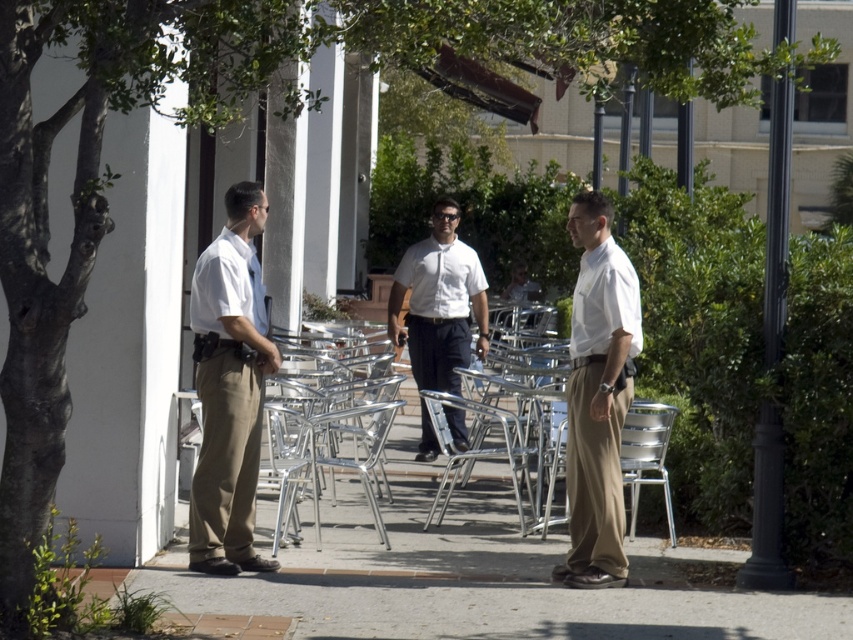
Question: Which object is the closest to the matte khaki pants at center?

Choices:
 (A) smooth concrete pavement at center
 (B) matte khaki pants at left
 (C) silver metallic chair at center
 (D) white shirt at center

Answer: (A)

Question: Estimate the real-world distances between objects in this image. Which object is closer to the smooth concrete pavement at center?

Choices:
 (A) matte khaki pants at center
 (B) silver metallic chair at center
 (C) matte khaki pants at left
 (D) white shirt at center

Answer: (A)

Question: Observing the image, what is the correct spatial positioning of matte khaki pants at center in reference to silver metallic chair at center?

Choices:
 (A) right
 (B) left

Answer: (A)

Question: Which of the following is the farthest from the observer?

Choices:
 (A) (405, 621)
 (B) (292, 412)

Answer: (B)

Question: From the image, what is the correct spatial relationship of matte khaki pants at center in relation to white shirt at center?

Choices:
 (A) below
 (B) above

Answer: (A)

Question: Is white shirt at center below silver metallic chair at center?

Choices:
 (A) yes
 (B) no

Answer: (B)